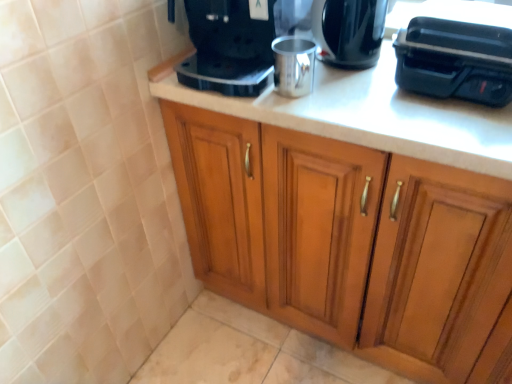
In order to click on free point in front of silver metallic cup at center, positioned as the second appliance in right-to-left order in this screenshot , I will do `click(329, 115)`.